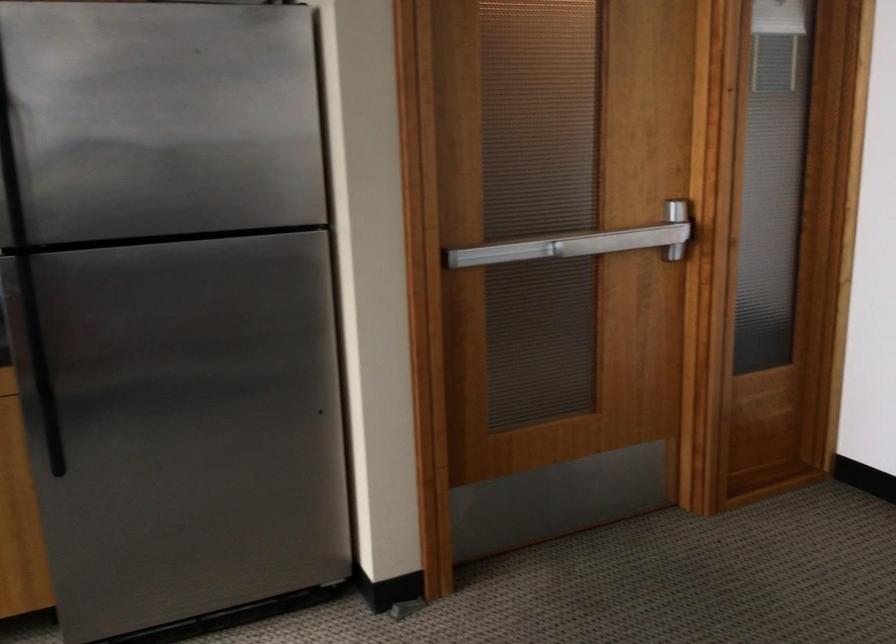
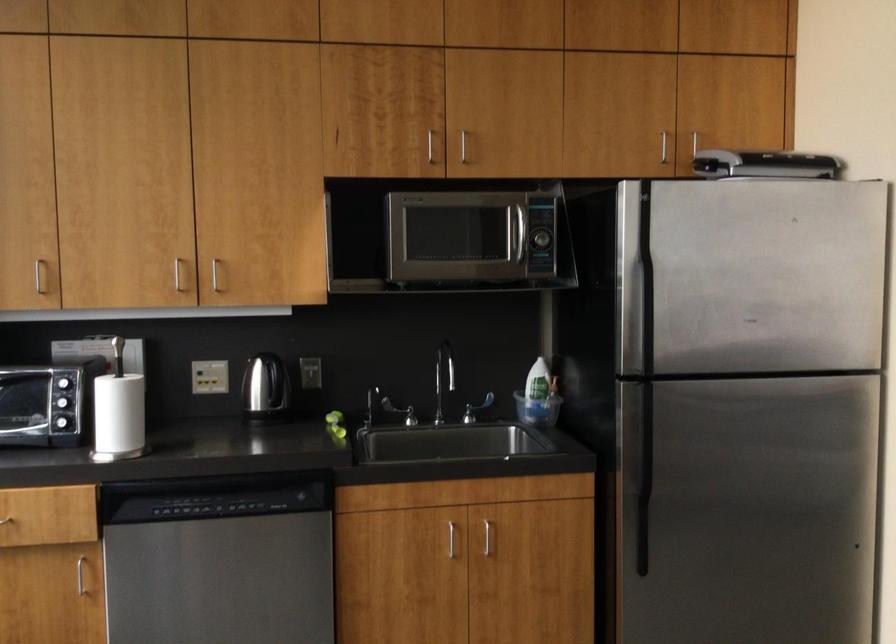
Question: How did the camera likely rotate?

Choices:
 (A) Left
 (B) Right
 (C) Up
 (D) Down

Answer: (A)